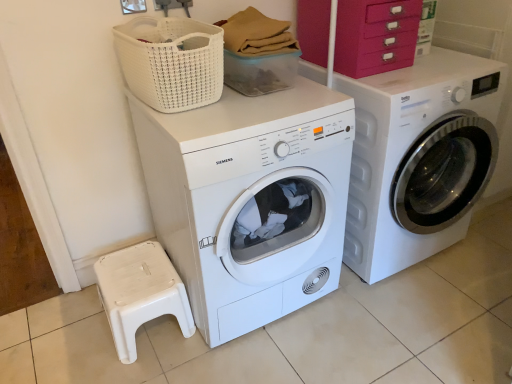
Locate an element on the screen. Image resolution: width=512 pixels, height=384 pixels. free region on the left part of white plastic step stool at lower left is located at coordinates (70, 334).